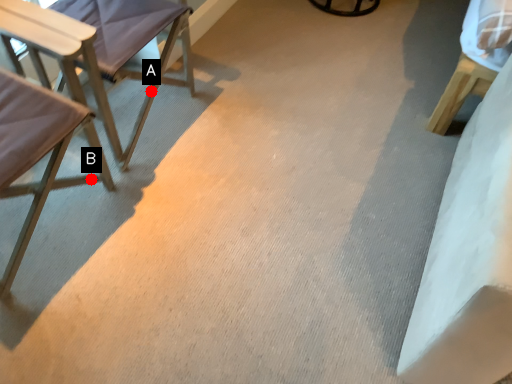
Question: Two points are circled on the image, labeled by A and B beside each circle. Which point is closer to the camera?

Choices:
 (A) A is closer
 (B) B is closer

Answer: (B)